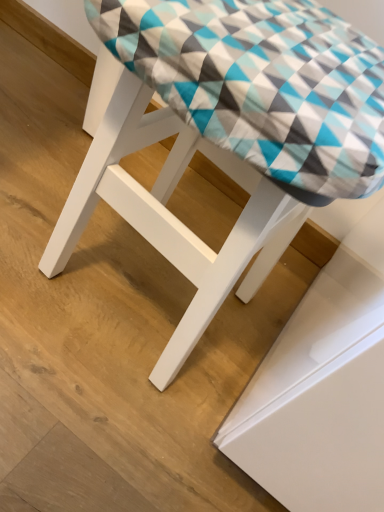
Question: Should I look upward or downward to see white matte stool at center?

Choices:
 (A) down
 (B) up

Answer: (B)